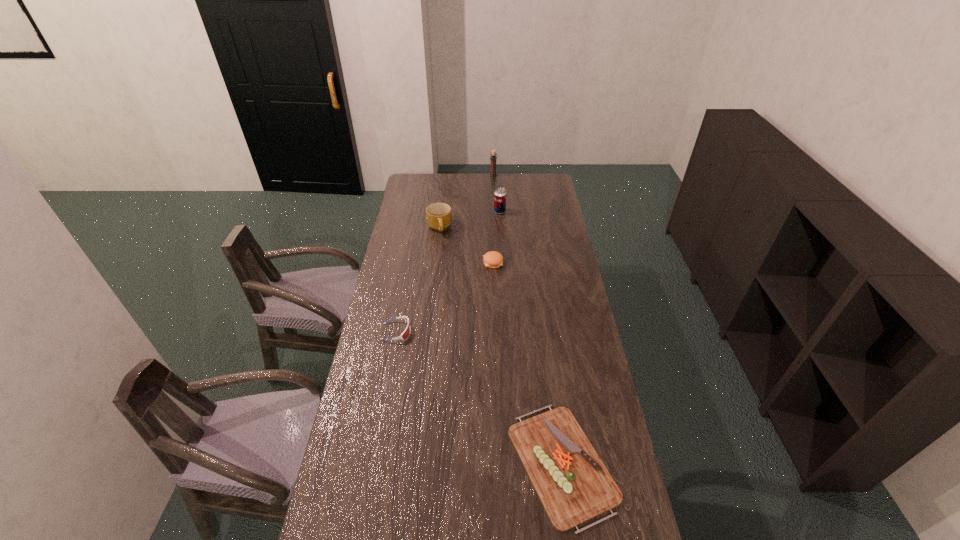
Where is `the tallest object`? This screenshot has width=960, height=540. the tallest object is located at coordinates (493, 157).

You are a GUI agent. You are given a task and a screenshot of the screen. Output one action in this format:
    pyautogui.click(x=<x>, y=<y>)
    Task: Click on the candle holder
    
    Given the screenshot: What is the action you would take?
    pyautogui.click(x=493, y=157)

Where is `the second farthest object`? The height and width of the screenshot is (540, 960). the second farthest object is located at coordinates (500, 193).

Find the location of a particular element. beer can is located at coordinates point(500,193).

Image resolution: width=960 pixels, height=540 pixels. In order to click on the third tallest object in this screenshot , I will do `click(438, 215)`.

Find the location of a particular element. This screenshot has width=960, height=540. the fourth nearest object is located at coordinates (438, 215).

You are a GUI agent. You are given a task and a screenshot of the screen. Output one action in this format:
    pyautogui.click(x=<x>, y=<y>)
    Task: Click on the second nearest object
    The image size is (960, 540).
    Given the screenshot: What is the action you would take?
    pyautogui.click(x=405, y=334)

Find the location of a particular element. Image resolution: width=960 pixels, height=540 pixels. the fourth farthest object is located at coordinates (492, 259).

This screenshot has width=960, height=540. Identify the location of chopping board. (573, 484).

Locate an element on the screen. the shortest object is located at coordinates (573, 484).